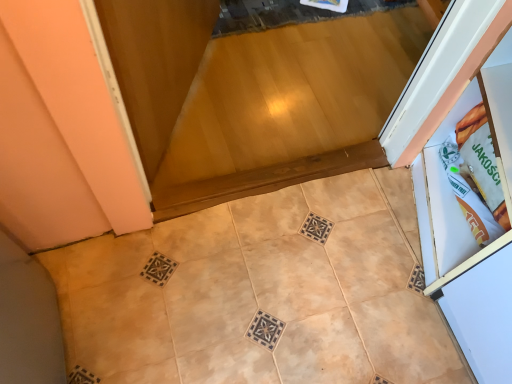
Where is `vacant position to the left of beige matte tile at center, the second ceramic tile when ordered from right to left`? This screenshot has width=512, height=384. vacant position to the left of beige matte tile at center, the second ceramic tile when ordered from right to left is located at coordinates (142, 315).